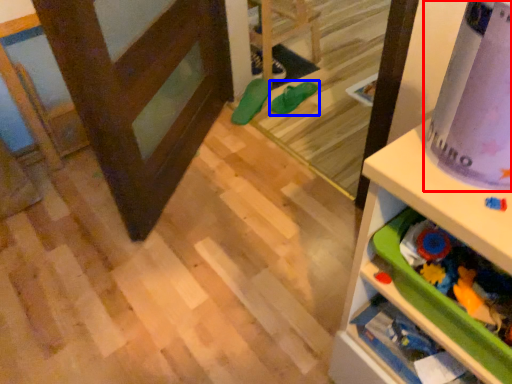
Question: Which point is further to the camera, wrapping paper (highlighted by a red box) or footwear (highlighted by a blue box)?

Choices:
 (A) wrapping paper
 (B) footwear

Answer: (B)